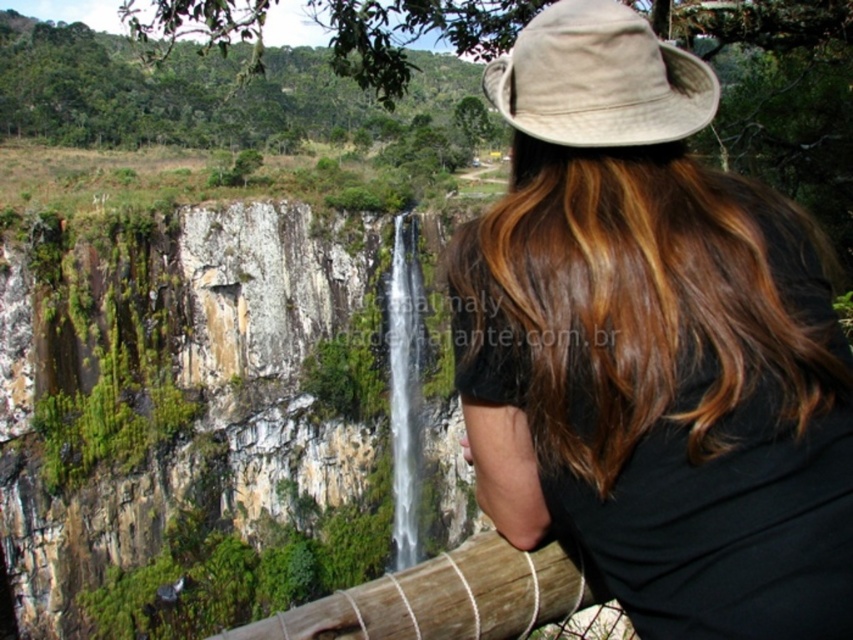
Based on the photo, you are standing at the viewpoint looking at the waterfall. There are two points marked on the cliff face. The first point is at coordinate point (78, 428) and the second is at point (602, 602). Which point is closer to the wooden railing where the person is leaning?

Point (78, 428) is behind point (602, 602), so the point closer to the wooden railing where the person is leaning is point (602, 602).

You are standing at the scenic waterfall and notice a person with brown hair at center and a green mossy rock at center. Which object is closer to you?

The brown hair at center is closer to the viewer than the green mossy rock at center.